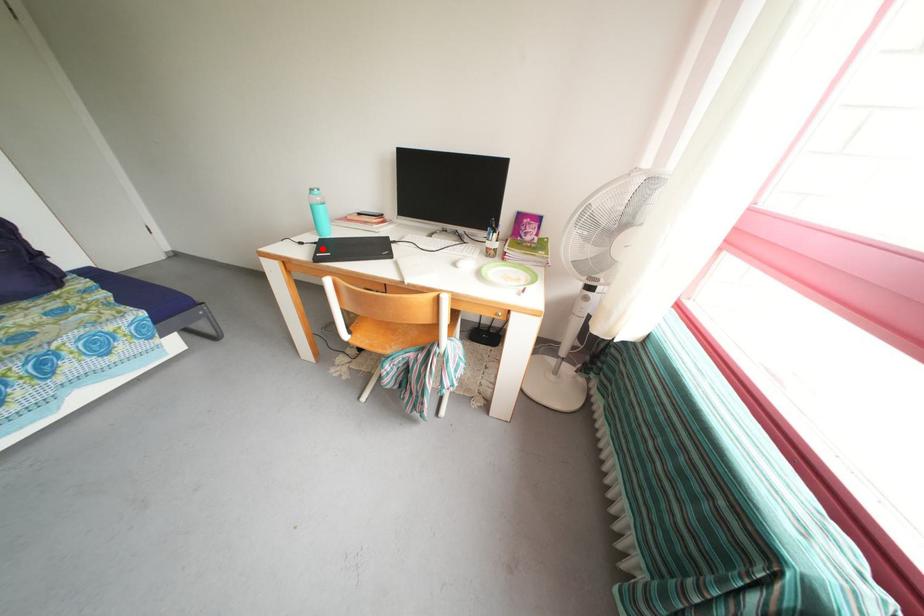
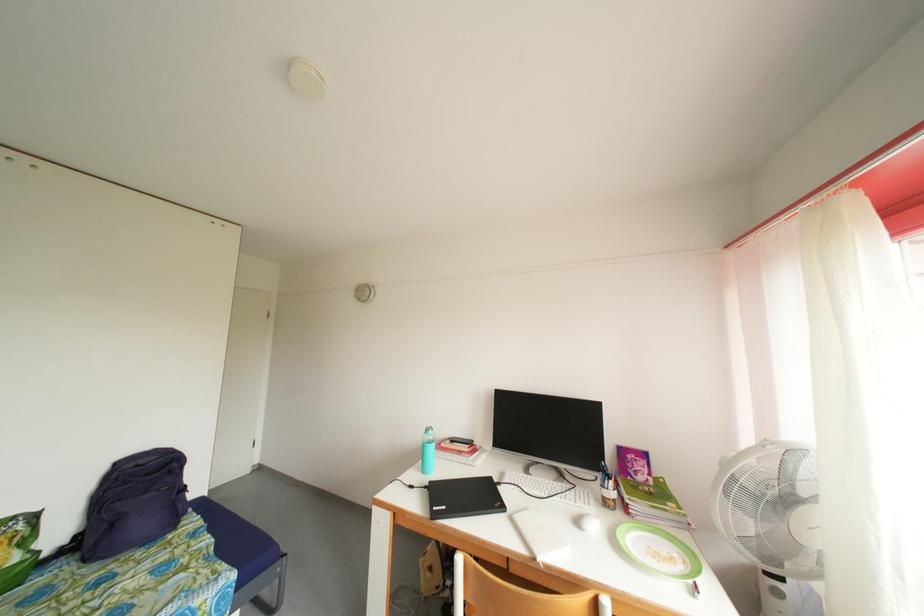
Where in the second image is the point corresponding to the highlighted location from the first image?

(432, 493)